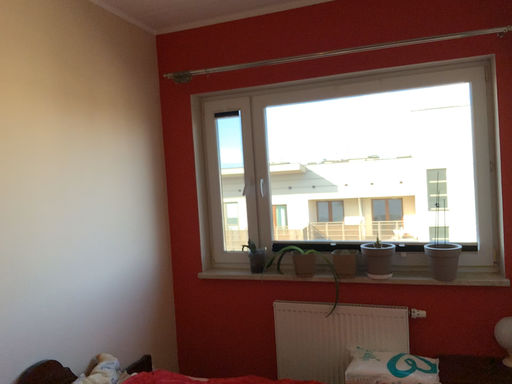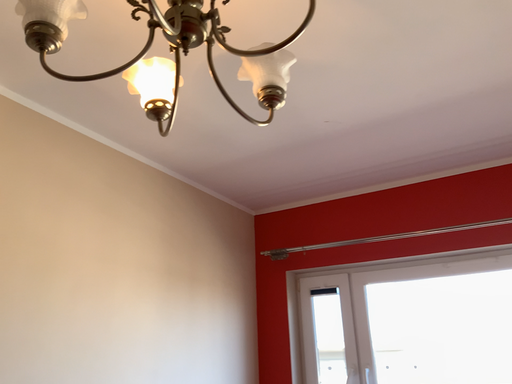
Question: How did the camera likely rotate when shooting the video?

Choices:
 (A) rotated left
 (B) rotated right

Answer: (A)